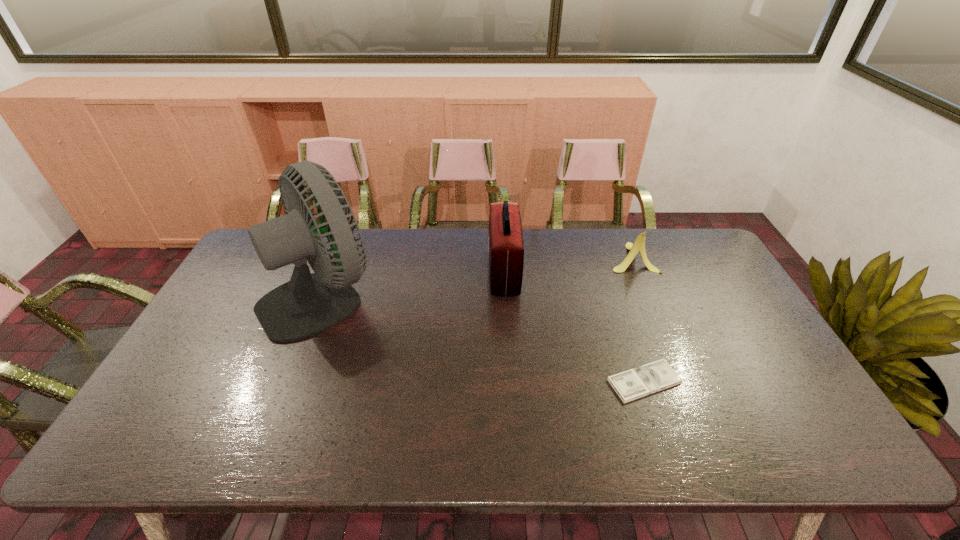
Image resolution: width=960 pixels, height=540 pixels. I want to click on free space at the right edge of the desktop, so click(x=694, y=276).

Locate an element on the screen. empty space between the banana and the fan is located at coordinates (477, 277).

Where is `blank region between the nearest object and the banana`? blank region between the nearest object and the banana is located at coordinates (638, 320).

You are a GUI agent. You are given a task and a screenshot of the screen. Output one action in this format:
    pyautogui.click(x=<x>, y=<y>)
    Task: Click on the vacant area between the leftmost object and the second tallest object
    The width and height of the screenshot is (960, 540).
    Given the screenshot: What is the action you would take?
    pyautogui.click(x=413, y=285)

At what (x,y) coordinates should I click in order to perform the action: click on vacant space that's between the tallest object and the nearest object. Please return your answer as a coordinate pair (x, y). This screenshot has height=540, width=960. Looking at the image, I should click on (483, 339).

Locate an element on the screen. empty space between the third tallest object and the fan is located at coordinates (477, 277).

I want to click on vacant space that is in between the leftmost object and the second object from left to right, so click(413, 285).

Identify the location of free spot between the second shortest object and the second tallest object. (567, 265).

Locate an element on the screen. The width and height of the screenshot is (960, 540). vacant region between the first aid kit and the third tallest object is located at coordinates (567, 265).

Locate an element on the screen. empty space between the fan and the dollar is located at coordinates (483, 339).